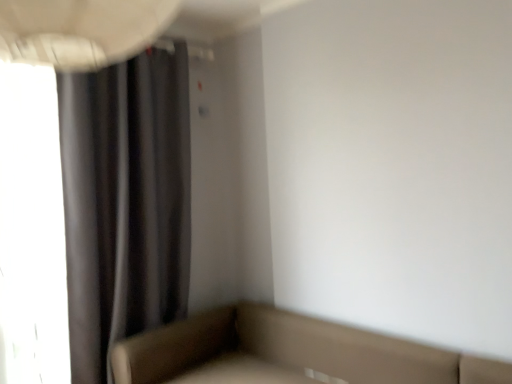
Question: Is dark matte curtain at left in front of or behind leather-like beige studio couch at lower right in the image?

Choices:
 (A) front
 (B) behind

Answer: (B)

Question: Is dark matte curtain at left wider or thinner than leather-like beige studio couch at lower right?

Choices:
 (A) thin
 (B) wide

Answer: (A)

Question: Is dark matte curtain at left to the left or to the right of leather-like beige studio couch at lower right in the image?

Choices:
 (A) right
 (B) left

Answer: (B)

Question: From a real-world perspective, is leather-like beige studio couch at lower right positioned above or below dark matte curtain at left?

Choices:
 (A) below
 (B) above

Answer: (A)

Question: Is leather-like beige studio couch at lower right situated inside dark matte curtain at left or outside?

Choices:
 (A) outside
 (B) inside

Answer: (A)

Question: In terms of width, does leather-like beige studio couch at lower right look wider or thinner when compared to dark matte curtain at left?

Choices:
 (A) thin
 (B) wide

Answer: (B)

Question: From the image's perspective, is leather-like beige studio couch at lower right positioned above or below dark matte curtain at left?

Choices:
 (A) above
 (B) below

Answer: (B)